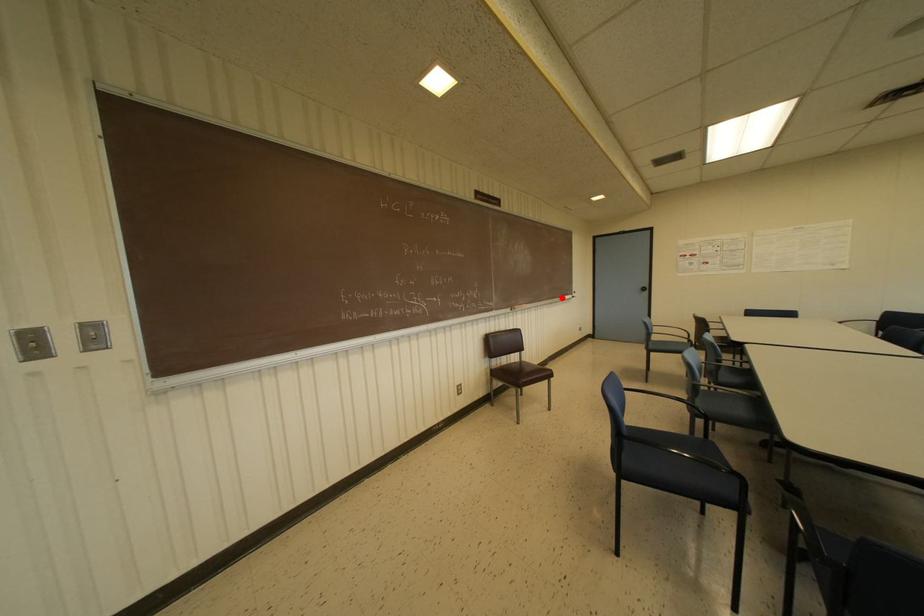
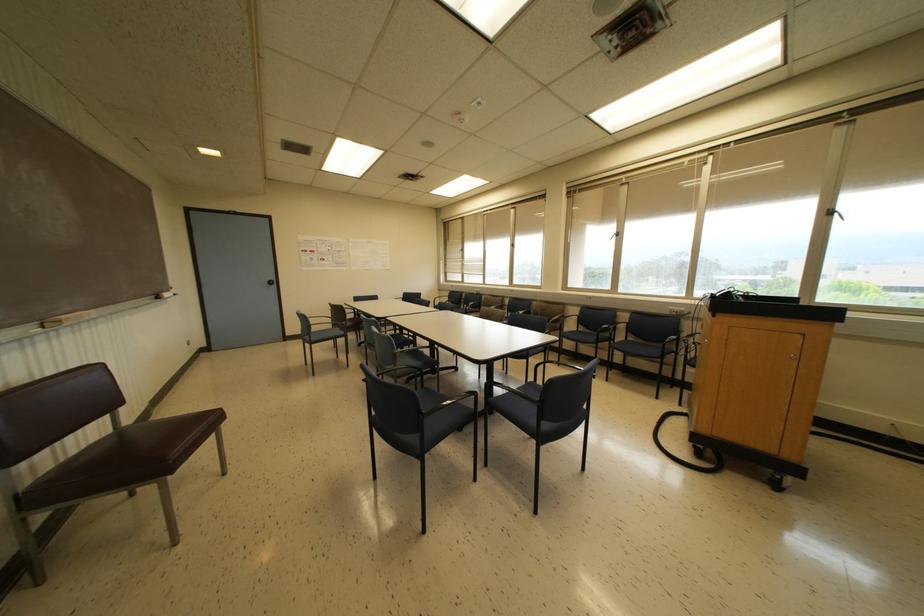
The point at the highlighted location is marked in the first image. Where is the corresponding point in the second image?

(157, 297)